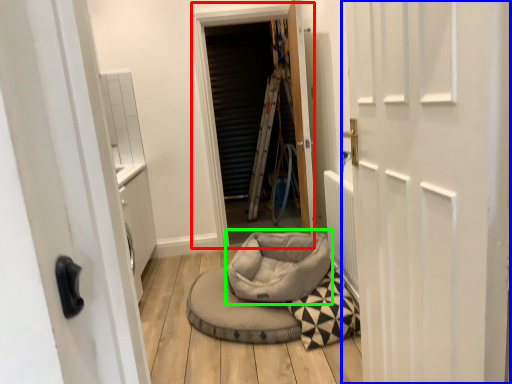
Question: Estimate the real-world distances between objects in this image. Which object is farther from window screen (highlighted by a red box), door (highlighted by a blue box) or bean bag chair (highlighted by a green box)?

Choices:
 (A) door
 (B) bean bag chair

Answer: (A)